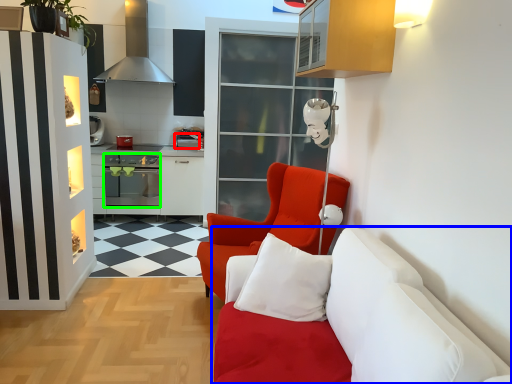
Question: Based on their relative distances, which object is farther from appliance (highlighted by a red box)? Choose from studio couch (highlighted by a blue box) and oven (highlighted by a green box).

Choices:
 (A) studio couch
 (B) oven

Answer: (A)